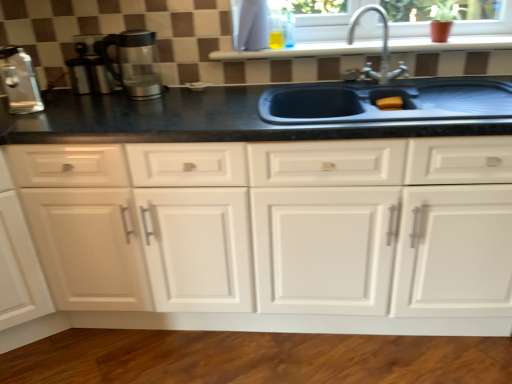
The width and height of the screenshot is (512, 384). What are the coordinates of `free space above white matte cabinet at center (from a real-world perspective)` in the screenshot? It's located at (204, 120).